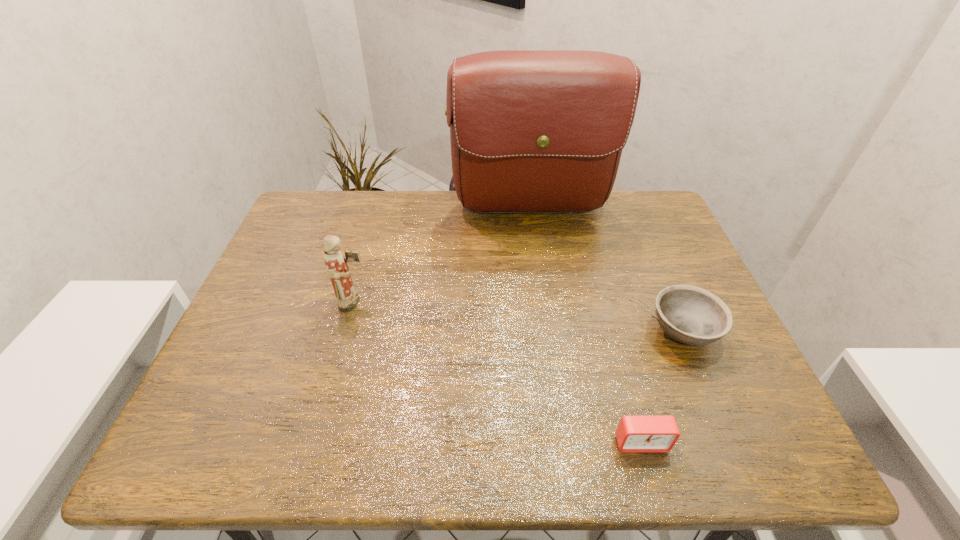
Locate an element on the screen. object located at the near edge is located at coordinates (635, 434).

The height and width of the screenshot is (540, 960). What are the coordinates of `object that is at the right edge` in the screenshot? It's located at (691, 315).

Where is `vacant space at the far edge`? This screenshot has width=960, height=540. vacant space at the far edge is located at coordinates tap(410, 198).

In the image, there is a desktop. At what (x,y) coordinates should I click in order to perform the action: click on vacant region at the near edge. Please return your answer as a coordinate pair (x, y). Looking at the image, I should click on (564, 431).

Identify the location of vacant space at the left edge of the desktop. The width and height of the screenshot is (960, 540). (257, 367).

Locate an element on the screen. This screenshot has width=960, height=540. blank space at the right edge of the desktop is located at coordinates (636, 256).

The width and height of the screenshot is (960, 540). In the image, there is a desktop. Identify the location of vacant area at the far left corner. (318, 234).

At what (x,y) coordinates should I click in order to perform the action: click on vacant area at the near left corner. Please return your answer as a coordinate pair (x, y). This screenshot has height=540, width=960. Looking at the image, I should click on (256, 443).

Where is `vacant point at the far right corner`? vacant point at the far right corner is located at coordinates (630, 222).

The height and width of the screenshot is (540, 960). Identify the location of empty space that is in between the alarm clock and the bowl. (661, 387).